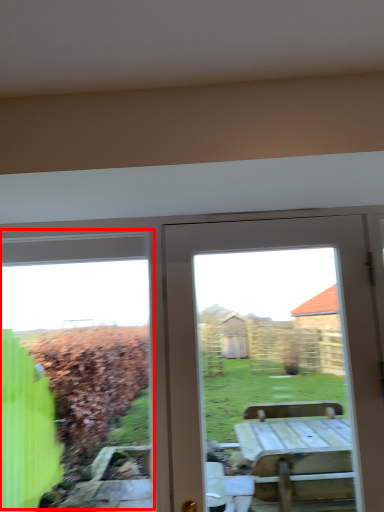
Question: From the image's perspective, what is the correct spatial relationship of bay window (annotated by the red box) in relation to door?

Choices:
 (A) above
 (B) below

Answer: (B)